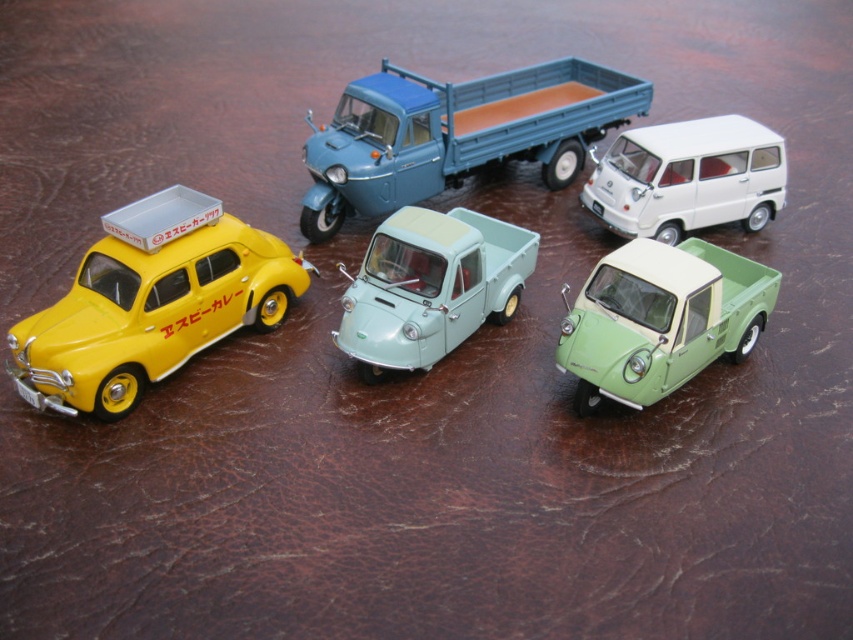
You are a toy collector examining the miniature vehicles. You want to place a small sticker on the closest vehicle to you between the blue matte truck at upper center and the white matte van at upper right. Which vehicle should you choose?

The blue matte truck at upper center is closer to the viewer than the white matte van at upper right, so you should place the sticker on the blue matte truck at upper center.